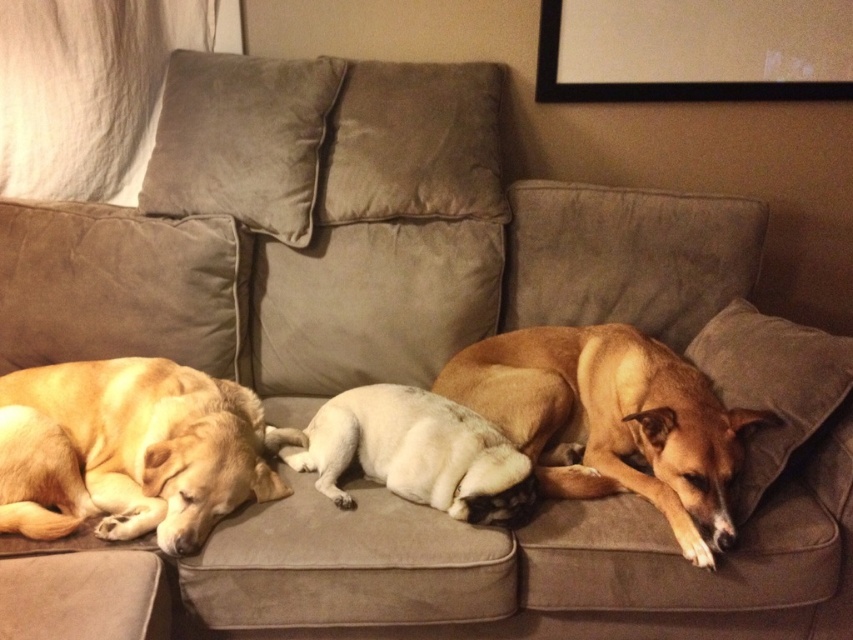
Is golden fur dog at left below white fur dog at center?

Actually, golden fur dog at left is above white fur dog at center.

Can you confirm if golden fur dog at left is smaller than white fur dog at center?

No.

Where is `golden fur dog at left`? golden fur dog at left is located at coordinates (128, 451).

Between brown smooth dog at center and black matte picture frame at upper right, which one is positioned lower?

brown smooth dog at center is below.

This screenshot has height=640, width=853. I want to click on brown smooth dog at center, so click(610, 420).

Which of these two, suede couch at center or suede pillow at right, stands taller?

suede couch at center is taller.

What do you see at coordinates (428, 381) in the screenshot?
I see `suede couch at center` at bounding box center [428, 381].

Is point (200, 570) closer to camera compared to point (701, 355)?

Yes.

At what (x,y) coordinates should I click in order to perform the action: click on suede couch at center. Please return your answer as a coordinate pair (x, y). Image resolution: width=853 pixels, height=640 pixels. Looking at the image, I should click on (428, 381).